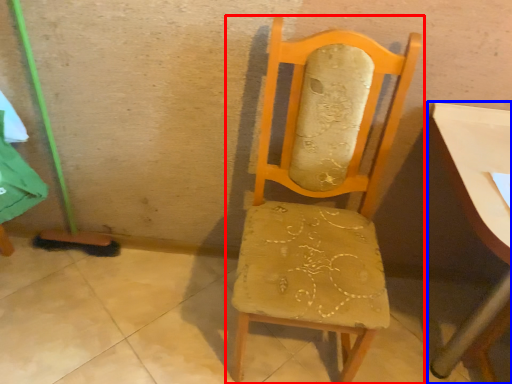
Question: Which point is further to the camera, chair (highlighted by a red box) or table (highlighted by a blue box)?

Choices:
 (A) chair
 (B) table

Answer: (B)